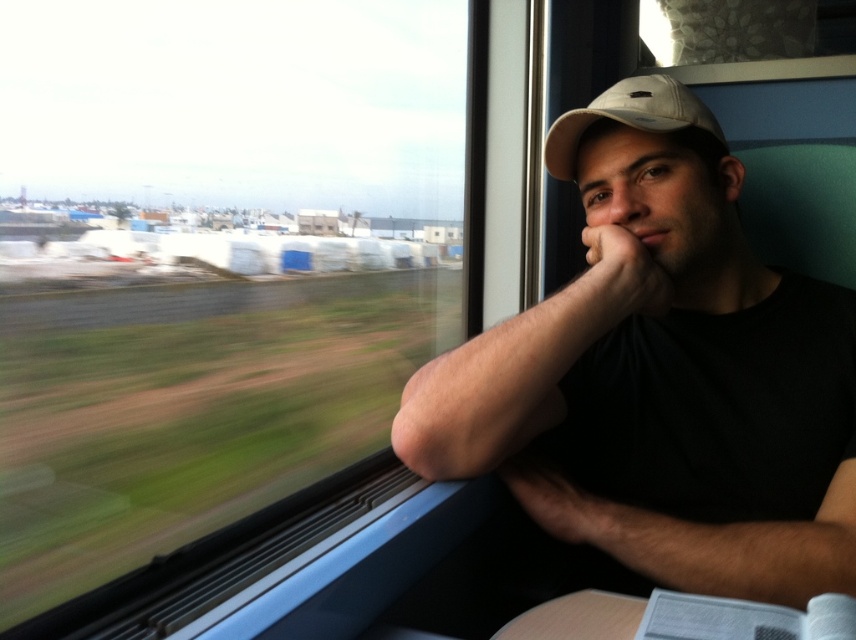
Question: Can you confirm if beige fabric cap at upper right is wider than white matte baseball cap at upper right?

Choices:
 (A) no
 (B) yes

Answer: (B)

Question: Which object is farther from the camera taking this photo?

Choices:
 (A) transparent glass train window at upper left
 (B) beige fabric cap at upper right
 (C) white matte baseball cap at upper right

Answer: (C)

Question: Does transparent glass train window at upper left appear under beige fabric cap at upper right?

Choices:
 (A) yes
 (B) no

Answer: (B)

Question: Which object is farther from the camera taking this photo?

Choices:
 (A) transparent glass train window at upper left
 (B) beige fabric cap at upper right

Answer: (A)

Question: Can you confirm if beige fabric cap at upper right is positioned to the right of white matte baseball cap at upper right?

Choices:
 (A) no
 (B) yes

Answer: (B)

Question: Which object is positioned closest to the white matte baseball cap at upper right?

Choices:
 (A) beige fabric cap at upper right
 (B) transparent glass train window at upper left

Answer: (A)